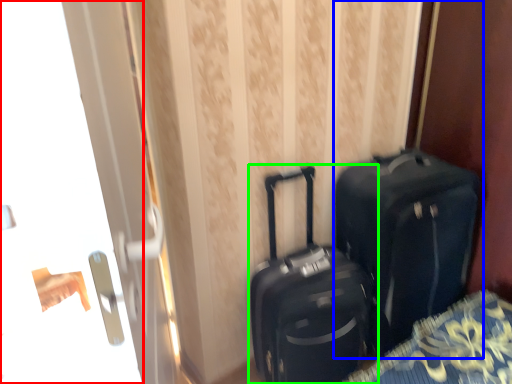
Question: Estimate the real-world distances between objects in this image. Which object is closer to screen door (highlighted by a red box), luggage and bags (highlighted by a blue box) or suitcase (highlighted by a green box)?

Choices:
 (A) luggage and bags
 (B) suitcase

Answer: (B)